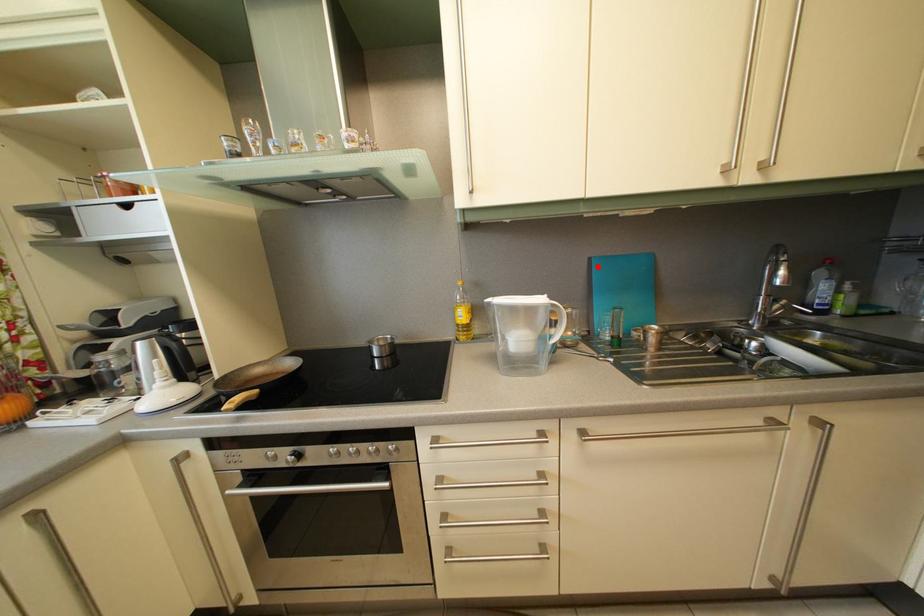
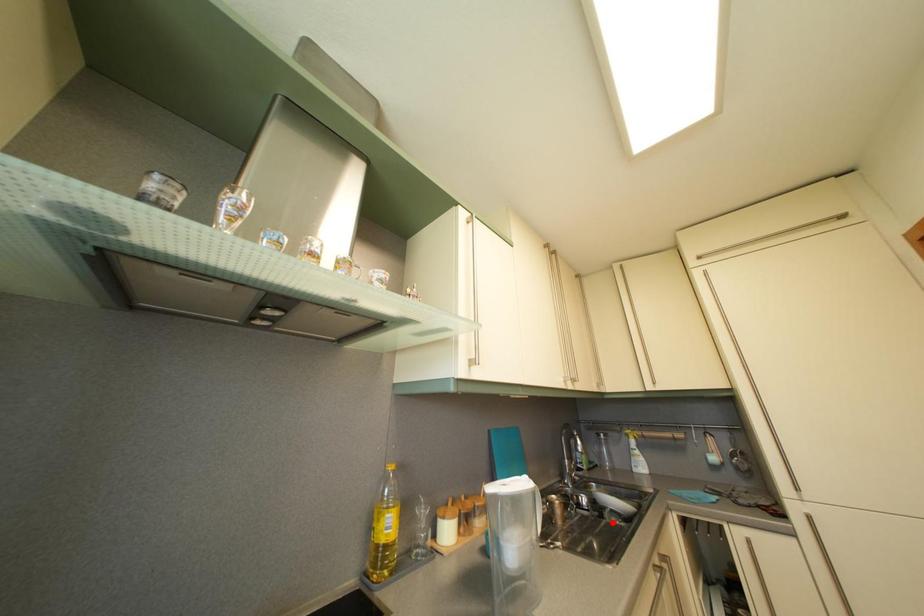
I am providing you with two images of the same scene from different viewpoints. A red point is marked on the first image and another point is marked on the second image. Are the points marked in image1 and image2 representing the same 3D position?

No